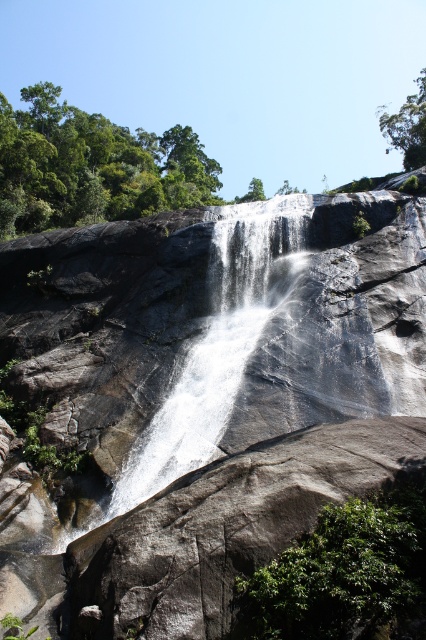
Which is above, white smooth waterfall at center or green leafy tree at upper right?

Positioned higher is green leafy tree at upper right.

Who is more distant from viewer, (152, 483) or (417, 99)?

The point (417, 99) is more distant.

Does point (301, 209) come farther from viewer compared to point (402, 113)?

No, (301, 209) is closer to viewer.

The height and width of the screenshot is (640, 426). I want to click on white smooth waterfall at center, so click(218, 342).

Which of these two, gray rough rock at center or green leafy tree at upper right, stands taller?

green leafy tree at upper right

Where is `gray rough rock at center`? gray rough rock at center is located at coordinates (203, 397).

Locate an element on the screen. The image size is (426, 640). gray rough rock at center is located at coordinates (203, 397).

Can you confirm if green leafy bush at lower right is smaller than green leafy tree at upper right?

Yes.

Does point (244, 600) lie behind point (420, 147)?

No, (244, 600) is closer to viewer.

Locate an element on the screen. green leafy bush at lower right is located at coordinates (345, 573).